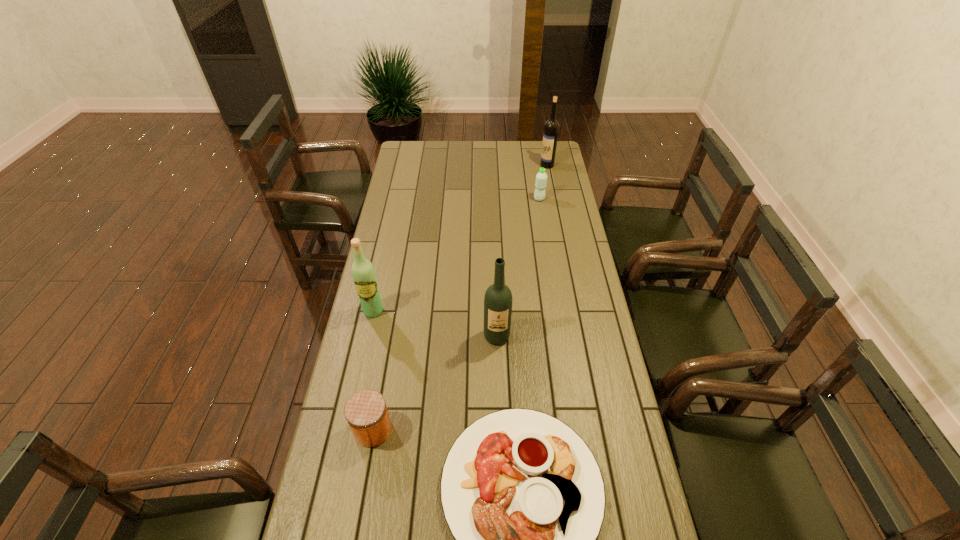
Find the location of a particular element. This screenshot has width=960, height=540. blank region between the farthest wine bottle and the fifth tallest object is located at coordinates (460, 297).

This screenshot has width=960, height=540. I want to click on blank region between the jar and the second nearest wine bottle, so click(x=373, y=370).

Locate an element on the screen. object that stands as the fourth closest to the platter is located at coordinates (541, 178).

Locate which object is the fourth closest to the jar. Please provide its 2D coordinates. Your answer should be formatted as a tuple, i.e. [(x, y)], where the tuple contains the x and y coordinates of a point satisfying the conditions above.

[(541, 178)]

Find the location of a particular element. wine bottle that stands as the closest to the third nearest object is located at coordinates click(363, 273).

Identify which wine bottle is the third nearest to the shortest object. Please provide its 2D coordinates. Your answer should be formatted as a tuple, i.e. [(x, y)], where the tuple contains the x and y coordinates of a point satisfying the conditions above.

[(551, 128)]